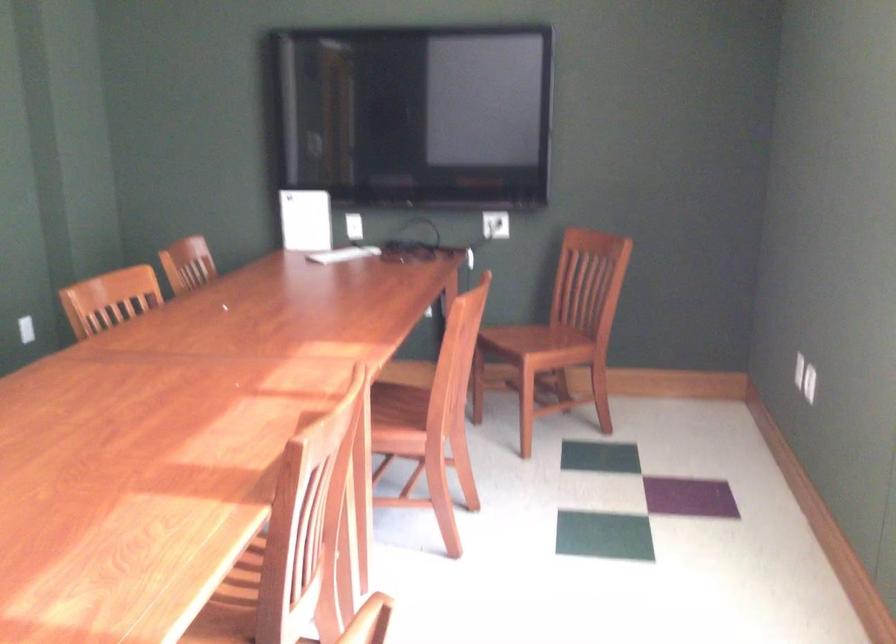
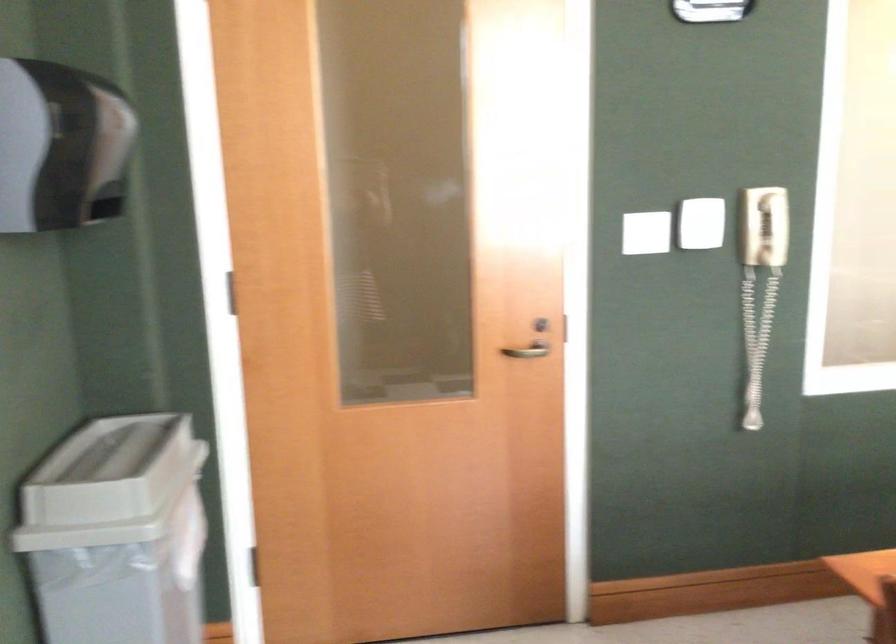
Question: The first image is from the beginning of the video and the second image is from the end. How did the camera likely rotate when shooting the video?

Choices:
 (A) Left
 (B) Right
 (C) Up
 (D) Down

Answer: (A)